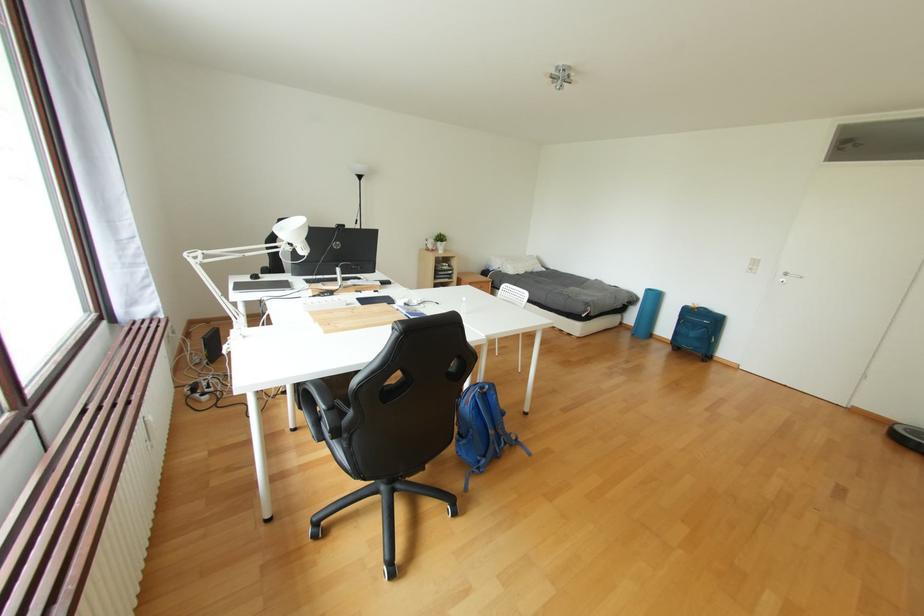
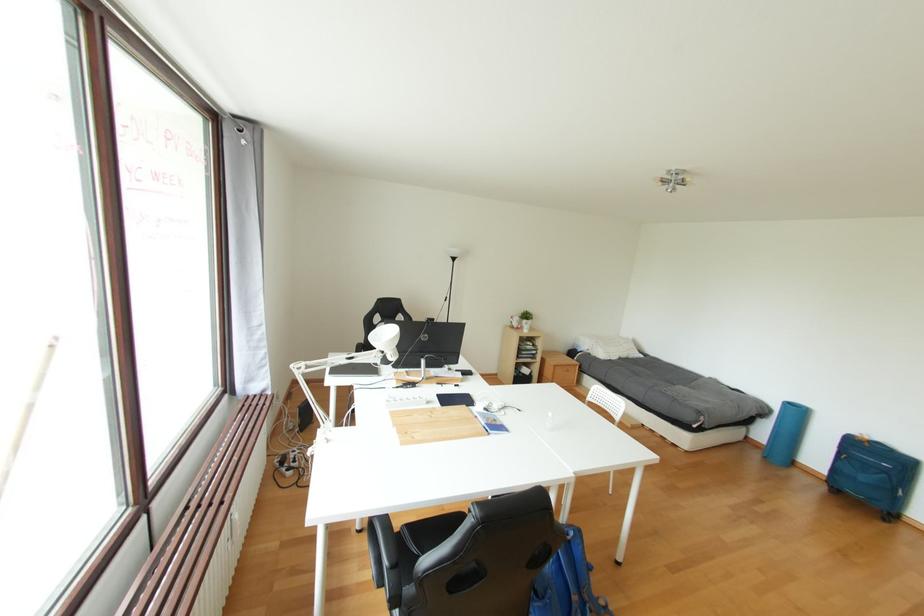
The images are taken continuously from a first-person perspective. In which direction are you moving?

The cameraman moved toward left, forward.